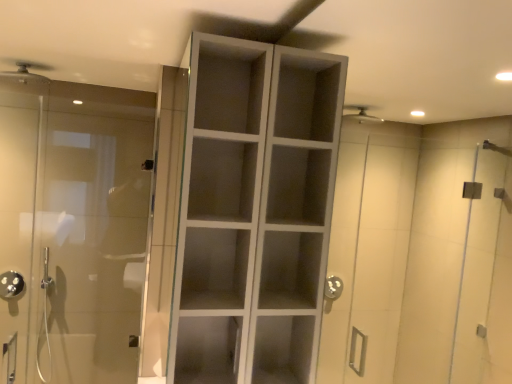
Question: Can you confirm if white matte cabinet at center is bigger than matte silver shower head at upper left, placed as the second shower when sorted from back to front?

Choices:
 (A) no
 (B) yes

Answer: (B)

Question: Considering the relative sizes of white matte cabinet at center and matte silver shower head at upper left, acting as the 2th shower starting from the bottom, in the image provided, is white matte cabinet at center wider than matte silver shower head at upper left, acting as the 2th shower starting from the bottom,?

Choices:
 (A) yes
 (B) no

Answer: (B)

Question: Is white matte cabinet at center oriented towards matte silver shower head at upper left, which is counted as the first shower, starting from the front?

Choices:
 (A) yes
 (B) no

Answer: (B)

Question: Considering the relative positions of white matte cabinet at center and matte silver shower head at upper left, which is counted as the first shower, starting from the front, in the image provided, is white matte cabinet at center to the right of matte silver shower head at upper left, which is counted as the first shower, starting from the front, from the viewer's perspective?

Choices:
 (A) yes
 (B) no

Answer: (A)

Question: From a real-world perspective, is white matte cabinet at center positioned under matte silver shower head at upper left, placed as the 1th shower when sorted from top to bottom, based on gravity?

Choices:
 (A) no
 (B) yes

Answer: (B)

Question: In terms of size, does transparent glass door at left appear bigger or smaller than matte silver shower head at upper left, which is counted as the first shower, starting from the front?

Choices:
 (A) small
 (B) big

Answer: (B)

Question: In terms of height, does transparent glass door at left look taller or shorter compared to matte silver shower head at upper left, the 1th shower from the right?

Choices:
 (A) short
 (B) tall

Answer: (B)

Question: Is point (113, 289) positioned closer to the camera than point (20, 72)?

Choices:
 (A) closer
 (B) farther

Answer: (B)

Question: From the image's perspective, is transparent glass door at left above or below matte silver shower head at upper left, placed as the 1th shower when sorted from top to bottom?

Choices:
 (A) above
 (B) below

Answer: (B)

Question: In terms of size, does white matte cabinet at center appear bigger or smaller than matte silver shower head at upper left, acting as the 2th shower starting from the bottom?

Choices:
 (A) big
 (B) small

Answer: (A)

Question: From the image's perspective, is white matte cabinet at center located above or below matte silver shower head at upper left, acting as the 2th shower starting from the bottom?

Choices:
 (A) above
 (B) below

Answer: (B)

Question: From a real-world perspective, is white matte cabinet at center positioned above or below matte silver shower head at upper left, placed as the second shower when sorted from back to front?

Choices:
 (A) above
 (B) below

Answer: (B)

Question: Considering the relative positions of white matte cabinet at center and matte silver shower head at upper left, which is the second shower in left-to-right order, in the image provided, is white matte cabinet at center to the left or to the right of matte silver shower head at upper left, which is the second shower in left-to-right order,?

Choices:
 (A) left
 (B) right

Answer: (B)

Question: Would you say polished chrome showerhead at left, the second shower viewed from the top, is inside or outside white matte cabinet at center?

Choices:
 (A) outside
 (B) inside

Answer: (A)

Question: Considering the positions of polished chrome showerhead at left, marked as the second shower in a front-to-back arrangement, and white matte cabinet at center in the image, is polished chrome showerhead at left, marked as the second shower in a front-to-back arrangement, wider or thinner than white matte cabinet at center?

Choices:
 (A) thin
 (B) wide

Answer: (A)